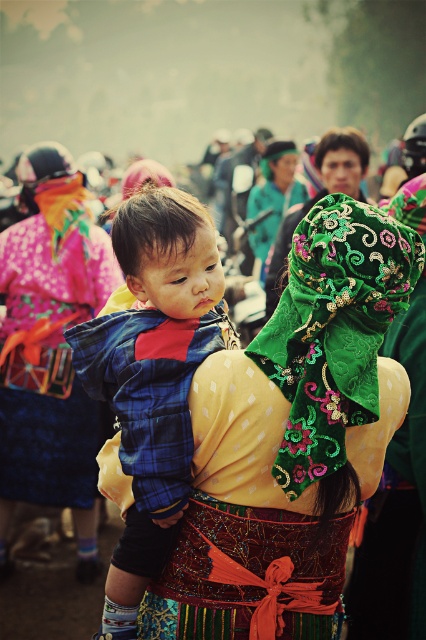
You are a photographer trying to capture the embroidered silk headscarf at center and the smooth brown hair at center in a single shot. Which object should you focus on first to ensure both are in focus?

You should focus on the embroidered silk headscarf at center first since it is closer to the viewer than the smooth brown hair at center, allowing the hair to fall into the depth of field when focusing on the closer object.

Where is the blue plaid shirt at center located in the image?

The blue plaid shirt at center is located at point (152, 376).

You are a photographer trying to capture a candid shot of the blue plaid shirt at center and the green embroidered fabric at upper center in the scene. Given that your camera has a maximum focus range of 8 meters, will you be able to capture both subjects in focus at the same time?

The distance between the blue plaid shirt at center and the green embroidered fabric at upper center is 8.27 meters. Since the camera can only focus up to 8 meters, it won not be able to capture both subjects in focus simultaneously.